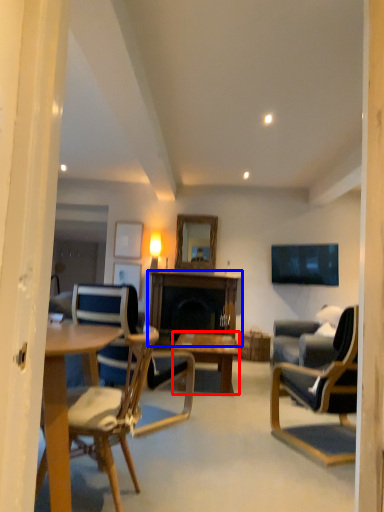
Question: Among these objects, which one is nearest to the camera, coffee table (highlighted by a red box) or table (highlighted by a blue box)?

Choices:
 (A) coffee table
 (B) table

Answer: (A)